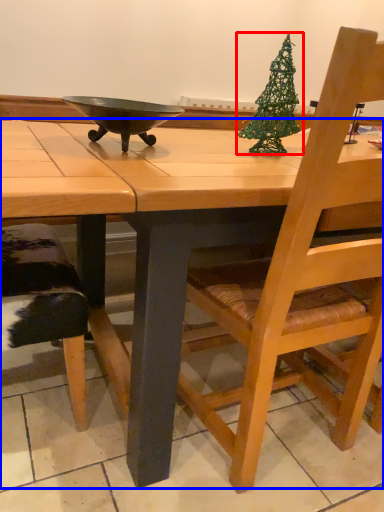
Question: Among these objects, which one is nearest to the camera, christmas tree (highlighted by a red box) or desk (highlighted by a blue box)?

Choices:
 (A) christmas tree
 (B) desk

Answer: (B)